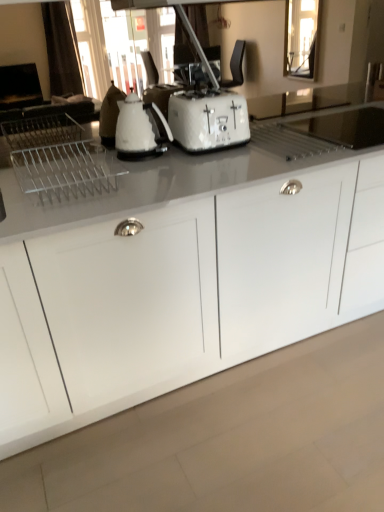
Find the location of a particular element. white glossy cabinet at center is located at coordinates (182, 294).

I want to click on white textured toaster at center, so click(x=208, y=119).

Measure the distance between white glossy kettle at center and white textured toaster at center.

white glossy kettle at center and white textured toaster at center are 6.10 inches apart.

Visually, is white glossy kettle at center positioned to the left or to the right of white textured toaster at center?

Based on their positions, white glossy kettle at center is located to the left of white textured toaster at center.

Which object is wider, white glossy kettle at center or white textured toaster at center?

white textured toaster at center is wider.

Is there a large distance between white textured toaster at center and white glossy kettle at center?

No.

Can you confirm if white textured toaster at center is taller than white glossy kettle at center?

Incorrect, the height of white textured toaster at center is not larger of that of white glossy kettle at center.

Is white textured toaster at center in front of white glossy kettle at center?

No, white textured toaster at center is further to the viewer.

Which point is more distant from viewer, (179, 96) or (143, 143)?

Point (179, 96)

I want to click on toaster behind the white glossy cabinet at center, so click(208, 119).

Which is behind, point (173, 130) or point (286, 339)?

The point (286, 339) is behind.

Is white textured toaster at center wider than white glossy cabinet at center?

No.

Looking at this image, which object is further away from the camera taking this photo, white textured toaster at center or white glossy cabinet at center?

white textured toaster at center is behind.

Considering the relative sizes of white glossy cabinet at center and white glossy kettle at center in the image provided, is white glossy cabinet at center bigger than white glossy kettle at center?

Correct, white glossy cabinet at center is larger in size than white glossy kettle at center.

In the image, is white glossy cabinet at center on the left side or the right side of white glossy kettle at center?

white glossy cabinet at center is positioned on white glossy kettle at center's right side.

Which point is more distant from viewer, (383, 279) or (164, 125)?

The point (383, 279) is behind.

Does white glossy cabinet at center have a greater width compared to white textured toaster at center?

Indeed, white glossy cabinet at center has a greater width compared to white textured toaster at center.

Can you confirm if white glossy cabinet at center is positioned to the left of white textured toaster at center?

Incorrect, white glossy cabinet at center is not on the left side of white textured toaster at center.

From a real-world perspective, is white glossy cabinet at center on top of white textured toaster at center?

No, from a real-world perspective, white glossy cabinet at center is not above white textured toaster at center.

Is point (163, 123) closer or farther from the camera than point (317, 324)?

Point (163, 123) appears to be closer to the viewer than point (317, 324).

Is white glossy kettle at center situated inside white glossy cabinet at center or outside?

white glossy kettle at center cannot be found inside white glossy cabinet at center.

Consider the image. Is white glossy kettle at center positioned far away from white glossy cabinet at center?

No, there isn't a large distance between white glossy kettle at center and white glossy cabinet at center.

From a real-world perspective, does white glossy kettle at center sit lower than white glossy cabinet at center?

Incorrect, from a real-world perspective, white glossy kettle at center is higher than white glossy cabinet at center.

What are the coordinates of `kitchen appliance that is above the white textured toaster at center (from a real-world perspective)` in the screenshot? It's located at (140, 128).

This screenshot has width=384, height=512. I want to click on toaster behind the white glossy kettle at center, so tap(208, 119).

When comparing their distances from white glossy kettle at center, does white textured toaster at center or white glossy cabinet at center seem further?

Based on the image, white glossy cabinet at center appears to be further to white glossy kettle at center.

When comparing their distances from white textured toaster at center, does white glossy cabinet at center or white glossy kettle at center seem further?

white glossy cabinet at center lies further to white textured toaster at center than the other object.

From the picture: Based on their spatial positions, is white glossy kettle at center or white glossy cabinet at center further from white textured toaster at center?

white glossy cabinet at center lies further to white textured toaster at center than the other object.

When comparing their distances from white glossy cabinet at center, does white glossy kettle at center or white textured toaster at center seem closer?

Based on the image, white textured toaster at center appears to be nearer to white glossy cabinet at center.

When comparing their distances from white glossy kettle at center, does white glossy cabinet at center or white textured toaster at center seem further?

The object further to white glossy kettle at center is white glossy cabinet at center.

When comparing their distances from white glossy cabinet at center, does white textured toaster at center or white glossy kettle at center seem further?

white glossy kettle at center is positioned further to the anchor white glossy cabinet at center.

Where is `kitchen appliance between white textured toaster at center and white glossy cabinet at center from top to bottom`? kitchen appliance between white textured toaster at center and white glossy cabinet at center from top to bottom is located at coordinates (140, 128).